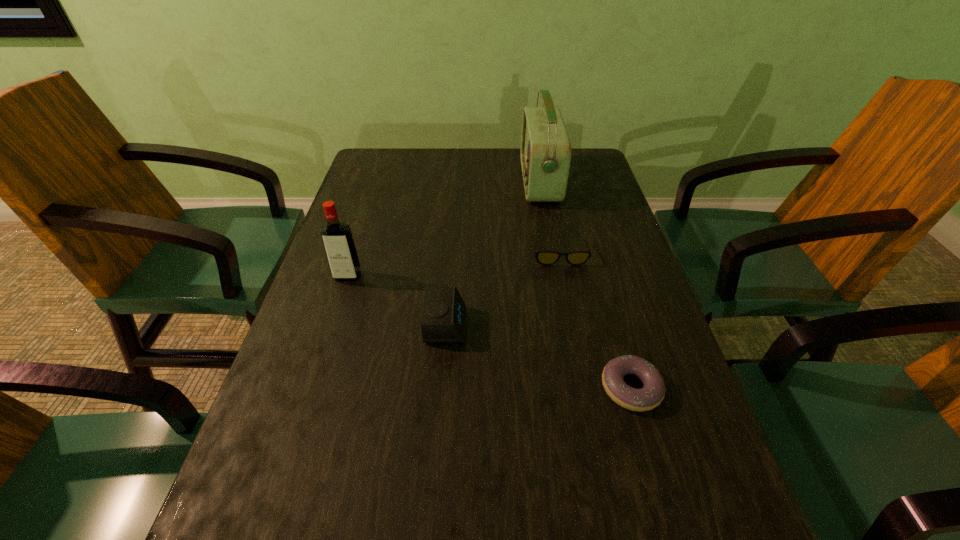
Image resolution: width=960 pixels, height=540 pixels. Identify the location of vacant area that lies between the fourth nearest object and the radio receiver. (549, 219).

Locate an element on the screen. vacant point located between the sunglasses and the leftmost object is located at coordinates (454, 266).

You are a GUI agent. You are given a task and a screenshot of the screen. Output one action in this format:
    pyautogui.click(x=<x>, y=<y>)
    Task: Click on the vacant area between the second tallest object and the sunglasses
    This screenshot has height=540, width=960.
    Given the screenshot: What is the action you would take?
    pyautogui.click(x=454, y=266)

At what (x,y) coordinates should I click in order to perform the action: click on free space between the fourth nearest object and the farthest object. Please return your answer as a coordinate pair (x, y). Looking at the image, I should click on (549, 219).

This screenshot has width=960, height=540. In order to click on free space between the sunglasses and the second object from left to right in this screenshot , I will do `click(503, 291)`.

Find the location of `object that is the nearest to the second farthest object`. object that is the nearest to the second farthest object is located at coordinates (545, 154).

This screenshot has width=960, height=540. In order to click on the closest object to the doughnut in this screenshot , I will do `click(443, 320)`.

Find the location of a particular element. The width and height of the screenshot is (960, 540). vacant space that satisfies the following two spatial constraints: 1. on the front-facing side of the sunglasses; 2. on the front-facing side of the fourth farthest object is located at coordinates tap(574, 325).

I want to click on vacant space that satisfies the following two spatial constraints: 1. on the front and back of the nearest object; 2. on the right side of the second tallest object, so click(312, 388).

Identify the location of vacant space that satisfies the following two spatial constraints: 1. on the front panel of the tallest object; 2. on the back side of the doughnut. (578, 388).